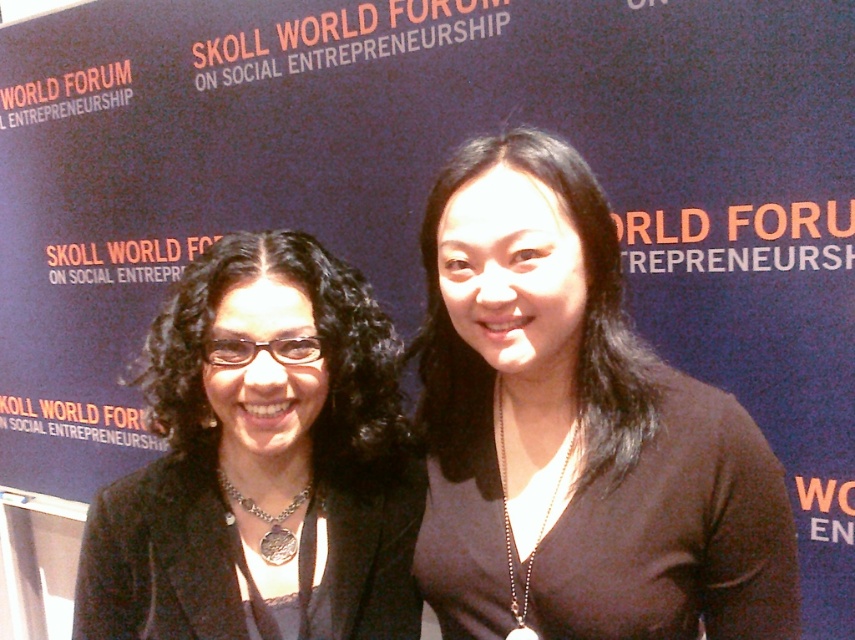
You are a photographer setting up for a group photo at the SKOLL WORLD FORUM ON SOCIAL ENTREPRENEURSHIP. You need to ensure that both the black matte shirt at center and the matte black jacket at left are in focus. Which object should you focus on first to ensure depth of field captures both?

The black matte shirt at center is closer to the viewer than the matte black jacket at left. To ensure both are in focus, you should focus on the matte black jacket at left since it is farther away, allowing the depth of field to extend backward to include the closer black matte shirt at center.

Based on the photo, you are organizing a photo shoot and need to decide if the black matte shirt at center and the matte black jacket at left will fit side by side in a frame that is 1.2 meters wide. Based on their widths, can they both fit without overlapping?

The black matte shirt at center might be wider than matte black jacket at left, so it is uncertain if they can fit side by side in a 1.2 meter frame without overlapping. The exact widths are not provided, so further measurement is needed.